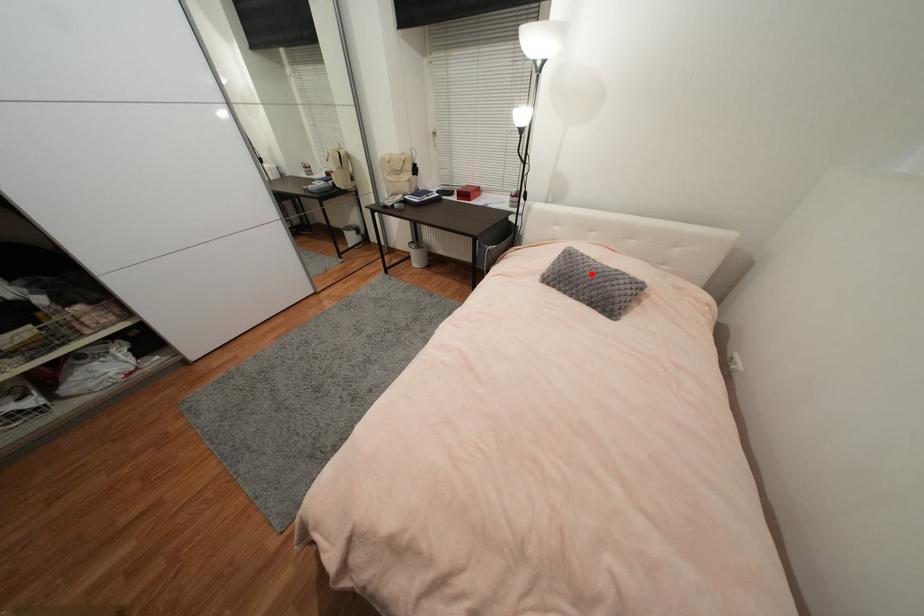
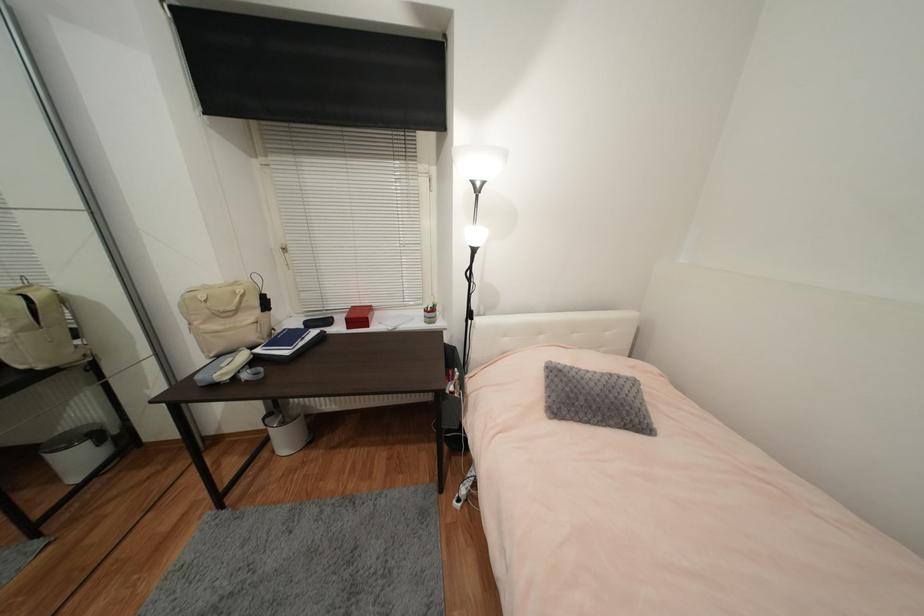
The point at the highlighted location is marked in the first image. Where is the corresponding point in the second image?

(602, 391)